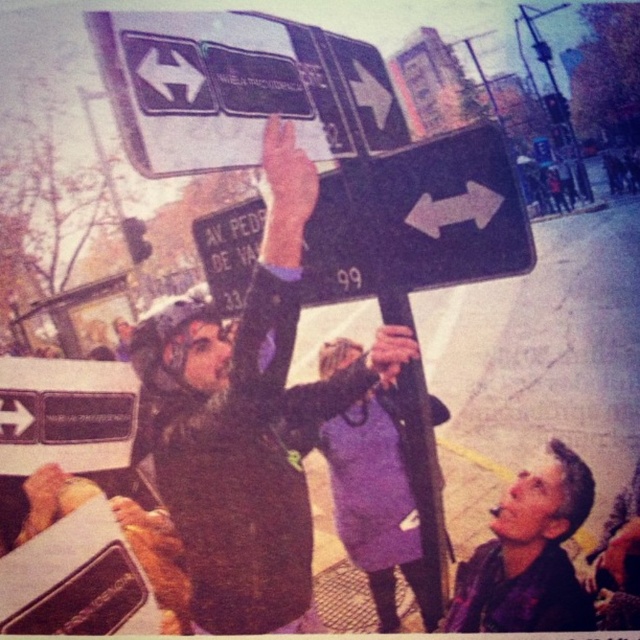
Question: Which point is closer to the camera?

Choices:
 (A) (518, 524)
 (B) (401, 545)
 (C) (195, 550)
 (D) (324, 208)

Answer: (A)

Question: Can you confirm if shiny purple jacket at lower right is positioned above purple fabric dress at center?

Choices:
 (A) no
 (B) yes

Answer: (A)

Question: Which point is closer to the camera taking this photo?

Choices:
 (A) (164, 474)
 (B) (419, 595)
 (C) (499, 616)
 (D) (358, 216)

Answer: (C)

Question: Is black matte sign at upper center to the left of shiny purple jacket at lower right from the viewer's perspective?

Choices:
 (A) yes
 (B) no

Answer: (A)

Question: Does dark brown fur coat at upper center have a smaller size compared to shiny purple jacket at lower right?

Choices:
 (A) yes
 (B) no

Answer: (B)

Question: Which is farther from the shiny purple jacket at lower right?

Choices:
 (A) purple fabric dress at center
 (B) dark brown fur coat at upper center

Answer: (B)